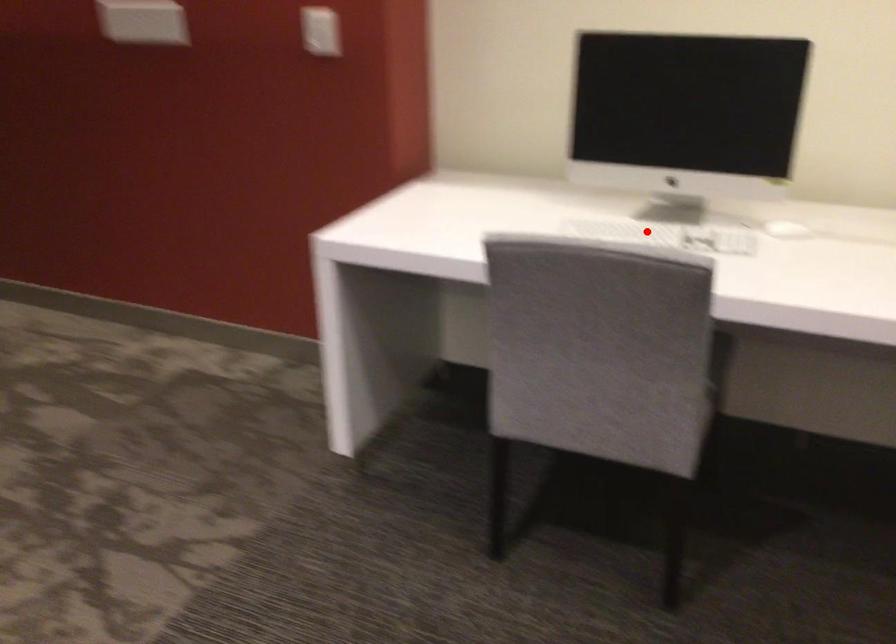
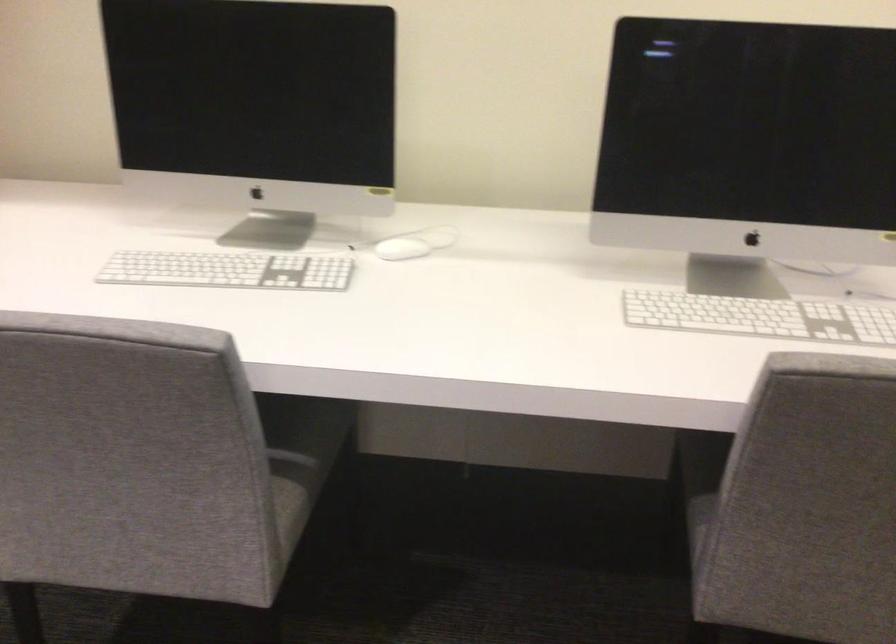
Question: I am providing you with two images of the same scene from different viewpoints. Given a red point in image1, look at the same physical point in image2. Is it:

Choices:
 (A) Closer to the viewpoint
 (B) Farther from the viewpoint

Answer: (A)